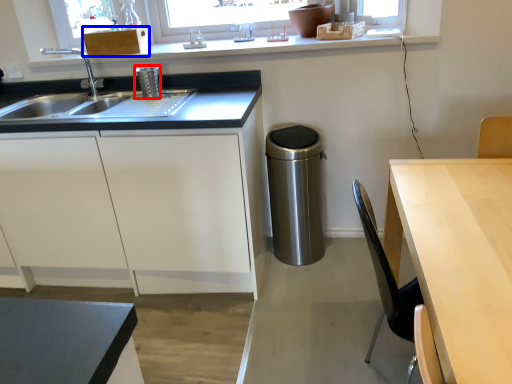
Question: Which of the following is the farthest to the observer, appliance (highlighted by a red box) or cabinetry (highlighted by a blue box)?

Choices:
 (A) appliance
 (B) cabinetry

Answer: (B)